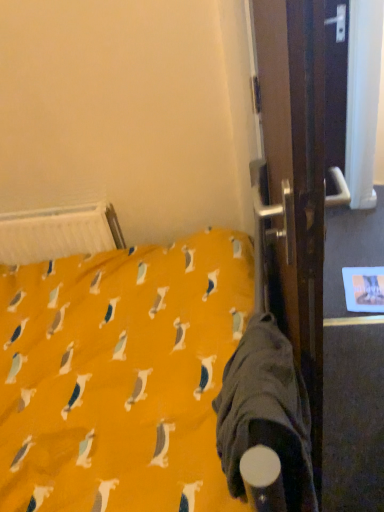
Question: Considering the relative sizes of white plastic radiator at upper left and dark gray fabric sleeping bag at lower right in the image provided, is white plastic radiator at upper left thinner than dark gray fabric sleeping bag at lower right?

Choices:
 (A) yes
 (B) no

Answer: (A)

Question: Is dark gray fabric sleeping bag at lower right a part of white plastic radiator at upper left?

Choices:
 (A) no
 (B) yes

Answer: (A)

Question: Can you confirm if white plastic radiator at upper left is shorter than dark gray fabric sleeping bag at lower right?

Choices:
 (A) no
 (B) yes

Answer: (B)

Question: Is white plastic radiator at upper left facing away from dark gray fabric sleeping bag at lower right?

Choices:
 (A) no
 (B) yes

Answer: (A)

Question: From a real-world perspective, is white plastic radiator at upper left positioned over dark gray fabric sleeping bag at lower right based on gravity?

Choices:
 (A) no
 (B) yes

Answer: (A)

Question: Is white plastic radiator at upper left beside dark gray fabric sleeping bag at lower right?

Choices:
 (A) no
 (B) yes

Answer: (A)

Question: From a real-world perspective, is dark gray fabric sleeping bag at lower right under white plastic radiator at upper left?

Choices:
 (A) yes
 (B) no

Answer: (B)

Question: From the image's perspective, is dark gray fabric sleeping bag at lower right on top of white plastic radiator at upper left?

Choices:
 (A) yes
 (B) no

Answer: (B)

Question: Is white plastic radiator at upper left at the back of dark gray fabric sleeping bag at lower right?

Choices:
 (A) yes
 (B) no

Answer: (B)

Question: Is dark gray fabric sleeping bag at lower right to the right of white plastic radiator at upper left from the viewer's perspective?

Choices:
 (A) yes
 (B) no

Answer: (A)

Question: From a real-world perspective, is dark gray fabric sleeping bag at lower right over white plastic radiator at upper left?

Choices:
 (A) no
 (B) yes

Answer: (B)

Question: Does dark gray fabric sleeping bag at lower right contain white plastic radiator at upper left?

Choices:
 (A) yes
 (B) no

Answer: (B)

Question: From a real-world perspective, is dark gray fabric sleeping bag at lower right positioned above or below white plastic radiator at upper left?

Choices:
 (A) above
 (B) below

Answer: (A)